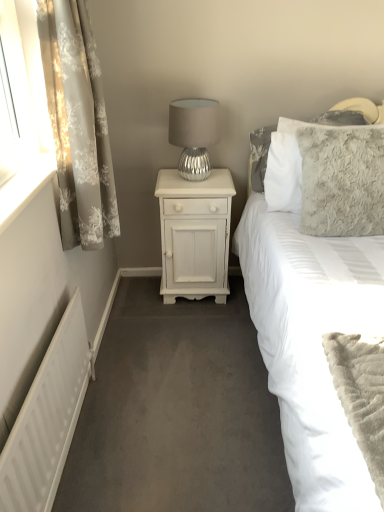
Identify the location of free area below silver metallic table lamp at upper center (from a real-world perspective). This screenshot has width=384, height=512. (193, 181).